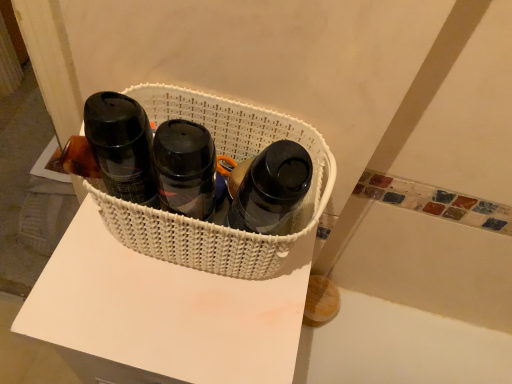
Describe the element at coordinates (122, 146) in the screenshot. The width and height of the screenshot is (512, 384). I see `matte black thermos at left, the 2th bottle from the right` at that location.

This screenshot has width=512, height=384. Identify the location of white woven basket at center. (234, 160).

This screenshot has width=512, height=384. In order to click on matte black thermos at left, marked as the 1th bottle in a left-to-right arrangement in this screenshot , I will do `click(122, 146)`.

You are a GUI agent. You are given a task and a screenshot of the screen. Output one action in this format:
    pyautogui.click(x=<x>, y=<y>)
    Task: Click on the table that appears behind the matte black bottle at center, which ranks as the first bottle in right-to-left order
    
    Given the screenshot: What is the action you would take?
    pyautogui.click(x=163, y=313)

Is white woven basket at center bigger than matte black bottle at center, which ranks as the first bottle in right-to-left order?

Yes, white woven basket at center is bigger than matte black bottle at center, which ranks as the first bottle in right-to-left order.

Based on the photo, does white woven basket at center lie behind matte black bottle at center, placed as the second bottle when sorted from left to right?

Yes.

Is white woven basket at center shorter than matte black bottle at center, placed as the second bottle when sorted from left to right?

Incorrect, the height of white woven basket at center does not fall short of that of matte black bottle at center, placed as the second bottle when sorted from left to right.

What's the angular difference between matte black bottle at center, placed as the second bottle when sorted from left to right, and white woven basket at center's facing directions?

The facing directions of matte black bottle at center, placed as the second bottle when sorted from left to right, and white woven basket at center are 0.00734 degrees apart.

The width and height of the screenshot is (512, 384). In order to click on the 2nd bottle located above the white woven basket at center (from a real-world perspective) in this screenshot , I will do `click(271, 188)`.

Considering the sizes of objects matte black bottle at center, which ranks as the first bottle in right-to-left order, and white woven basket at center in the image provided, who is shorter, matte black bottle at center, which ranks as the first bottle in right-to-left order, or white woven basket at center?

white woven basket at center.

Between matte black bottle at center, placed as the second bottle when sorted from left to right, and white woven basket at center, which one is positioned in front?

matte black bottle at center, placed as the second bottle when sorted from left to right, is more forward.

From a real-world perspective, is white woven basket at center above or below matte black bottle at center, which ranks as the first bottle in right-to-left order?

From a real-world perspective, white woven basket at center is physically below matte black bottle at center, which ranks as the first bottle in right-to-left order.

Is point (280, 256) positioned before point (268, 148)?

No, (280, 256) is behind (268, 148).

Which of these two, white woven basket at center or matte black bottle at center, which ranks as the first bottle in right-to-left order, is smaller?

matte black bottle at center, which ranks as the first bottle in right-to-left order.

Does white woven basket at center touch matte black bottle at center, which ranks as the first bottle in right-to-left order?

Yes, white woven basket at center is with matte black bottle at center, which ranks as the first bottle in right-to-left order.

Is white woven basket at center not within white woven basket at center?

That's correct, white woven basket at center is outside of white woven basket at center.

Would you say white woven basket at center is to the left or to the right of white woven basket at center in the picture?

Based on their positions, white woven basket at center is located to the left of white woven basket at center.

Which is closer to the camera, (x=136, y=357) or (x=133, y=245)?

Point (x=136, y=357) is positioned closer to the camera compared to point (x=133, y=245).

Is point (145, 182) closer to viewer compared to point (84, 332)?

That is True.

Is matte black thermos at left, the 2th bottle from the right, next to white woven basket at center and touching it?

matte black thermos at left, the 2th bottle from the right, and white woven basket at center are not in contact.

What's the angular difference between matte black thermos at left, marked as the 1th bottle in a left-to-right arrangement, and white woven basket at center's facing directions?

The angle between the facing direction of matte black thermos at left, marked as the 1th bottle in a left-to-right arrangement, and the facing direction of white woven basket at center is 0.923 degrees.

Considering the sizes of objects matte black bottle at center, placed as the second bottle when sorted from left to right, and matte black thermos at left, the 2th bottle from the right, in the image provided, who is wider, matte black bottle at center, placed as the second bottle when sorted from left to right, or matte black thermos at left, the 2th bottle from the right,?

Wider between the two is matte black bottle at center, placed as the second bottle when sorted from left to right.

From the image's perspective, is matte black bottle at center, which ranks as the first bottle in right-to-left order, above matte black thermos at left, the 2th bottle from the right?

No.

Where is `bottle that is above the matte black bottle at center, placed as the second bottle when sorted from left to right (from the image's perspective)`? This screenshot has height=384, width=512. bottle that is above the matte black bottle at center, placed as the second bottle when sorted from left to right (from the image's perspective) is located at coordinates (122, 146).

Is matte black bottle at center, which ranks as the first bottle in right-to-left order, in front of or behind matte black thermos at left, the 2th bottle from the right, in the image?

Visually, matte black bottle at center, which ranks as the first bottle in right-to-left order, is located in front of matte black thermos at left, the 2th bottle from the right.

Is point (151, 193) farther from viewer compared to point (297, 132)?

No, (151, 193) is closer to viewer.

Considering the positions of objects matte black thermos at left, marked as the 1th bottle in a left-to-right arrangement, and white woven basket at center in the image provided, who is behind, matte black thermos at left, marked as the 1th bottle in a left-to-right arrangement, or white woven basket at center?

Positioned behind is white woven basket at center.

Visually, is matte black thermos at left, the 2th bottle from the right, positioned to the left or to the right of white woven basket at center?

matte black thermos at left, the 2th bottle from the right, is to the left of white woven basket at center.

From the image's perspective, relative to white woven basket at center, is matte black thermos at left, the 2th bottle from the right, above or below?

matte black thermos at left, the 2th bottle from the right, is situated lower than white woven basket at center in the image.

From a real-world perspective, which bottle is the 2nd one above the white woven basket at center? Please provide its 2D coordinates.

[(271, 188)]

Identify the location of bottle that is the 2nd one when counting forward from the white woven basket at center. The width and height of the screenshot is (512, 384). (271, 188).

Based on their spatial positions, is white woven basket at center or matte black bottle at center, placed as the second bottle when sorted from left to right, further from white woven basket at center?

matte black bottle at center, placed as the second bottle when sorted from left to right, is positioned further to the anchor white woven basket at center.

Which object lies nearer to the anchor point matte black thermos at left, marked as the 1th bottle in a left-to-right arrangement, white woven basket at center or matte black bottle at center, which ranks as the first bottle in right-to-left order?

matte black bottle at center, which ranks as the first bottle in right-to-left order, is positioned closer to the anchor matte black thermos at left, marked as the 1th bottle in a left-to-right arrangement.

Based on their spatial positions, is white woven basket at center or matte black thermos at left, the 2th bottle from the right, closer to white woven basket at center?

white woven basket at center is positioned closer to the anchor white woven basket at center.

Considering their positions, is matte black thermos at left, the 2th bottle from the right, positioned closer to matte black bottle at center, which ranks as the first bottle in right-to-left order, than white woven basket at center?

The object closer to matte black bottle at center, which ranks as the first bottle in right-to-left order, is white woven basket at center.

Looking at the image, which one is located closer to matte black bottle at center, placed as the second bottle when sorted from left to right, white woven basket at center or white woven basket at center?

The object closer to matte black bottle at center, placed as the second bottle when sorted from left to right, is white woven basket at center.

When comparing their distances from white woven basket at center, does matte black thermos at left, marked as the 1th bottle in a left-to-right arrangement, or white woven basket at center seem further?

Based on the image, matte black thermos at left, marked as the 1th bottle in a left-to-right arrangement, appears to be further to white woven basket at center.

Looking at the image, which one is located further to white woven basket at center, matte black bottle at center, placed as the second bottle when sorted from left to right, or white woven basket at center?

matte black bottle at center, placed as the second bottle when sorted from left to right.

When comparing their distances from white woven basket at center, does white woven basket at center or matte black bottle at center, placed as the second bottle when sorted from left to right, seem further?

matte black bottle at center, placed as the second bottle when sorted from left to right, lies further to white woven basket at center than the other object.

Image resolution: width=512 pixels, height=384 pixels. Find the location of `bottle between matte black thermos at left, marked as the 1th bottle in a left-to-right arrangement, and white woven basket at center from top to bottom`. bottle between matte black thermos at left, marked as the 1th bottle in a left-to-right arrangement, and white woven basket at center from top to bottom is located at coordinates (271, 188).

The height and width of the screenshot is (384, 512). Find the location of `basket between matte black thermos at left, marked as the 1th bottle in a left-to-right arrangement, and matte black bottle at center, which ranks as the first bottle in right-to-left order, from left to right`. basket between matte black thermos at left, marked as the 1th bottle in a left-to-right arrangement, and matte black bottle at center, which ranks as the first bottle in right-to-left order, from left to right is located at coordinates (234, 160).